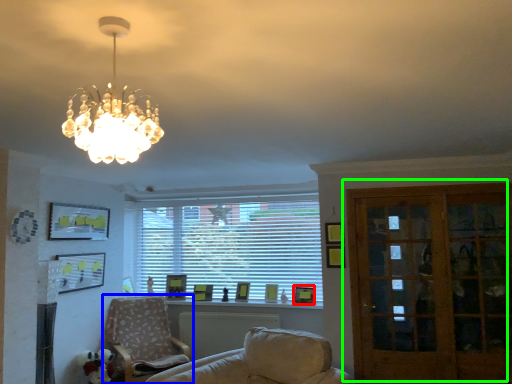
Question: Estimate the real-world distances between objects in this image. Which object is closer to picture frame (highlighted by a red box), chair (highlighted by a blue box) or door (highlighted by a green box)?

Choices:
 (A) chair
 (B) door

Answer: (B)